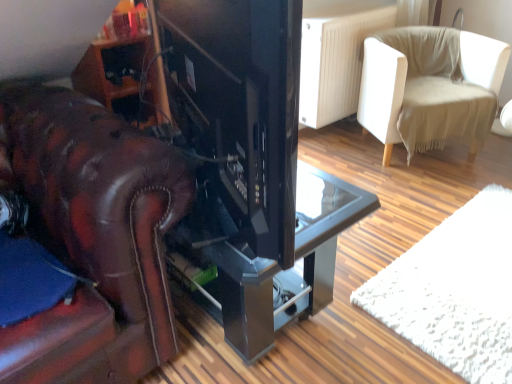
Question: From a real-world perspective, is matte black tv at center positioned over beige fabric chair at upper right based on gravity?

Choices:
 (A) no
 (B) yes

Answer: (B)

Question: From the image's perspective, would you say matte black tv at center is positioned over beige fabric chair at upper right?

Choices:
 (A) yes
 (B) no

Answer: (B)

Question: Is beige fabric chair at upper right located within matte black tv at center?

Choices:
 (A) yes
 (B) no

Answer: (B)

Question: From the image's perspective, does matte black tv at center appear lower than beige fabric chair at upper right?

Choices:
 (A) no
 (B) yes

Answer: (B)

Question: Is matte black tv at center not close to beige fabric chair at upper right?

Choices:
 (A) no
 (B) yes

Answer: (B)

Question: From a real-world perspective, is matte black tv at center below beige fabric chair at upper right?

Choices:
 (A) no
 (B) yes

Answer: (A)

Question: Considering the relative positions of glossy black table at center and matte black tv at center in the image provided, is glossy black table at center to the right of matte black tv at center from the viewer's perspective?

Choices:
 (A) yes
 (B) no

Answer: (A)

Question: From a real-world perspective, is glossy black table at center physically below matte black tv at center?

Choices:
 (A) yes
 (B) no

Answer: (A)

Question: Is the depth of glossy black table at center greater than that of matte black tv at center?

Choices:
 (A) no
 (B) yes

Answer: (B)

Question: Is matte black tv at center at the back of glossy black table at center?

Choices:
 (A) yes
 (B) no

Answer: (B)

Question: Could you tell me if glossy black table at center is facing matte black tv at center?

Choices:
 (A) no
 (B) yes

Answer: (A)

Question: Is matte black tv at center completely or partially inside glossy black table at center?

Choices:
 (A) yes
 (B) no

Answer: (B)

Question: Considering the relative sizes of matte black tv at center and glossy black table at center in the image provided, is matte black tv at center wider than glossy black table at center?

Choices:
 (A) no
 (B) yes

Answer: (A)